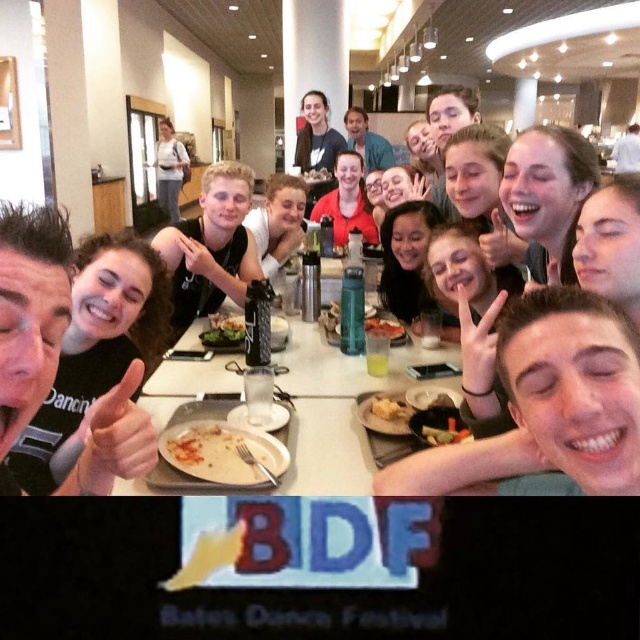
You are a photographer standing at the edge of the table in the dining area. You need to capture a photo of both the matte black shirt at upper center and the translucent plastic cup at center without moving the subjects. Can you position yourself in a way that both items are in your camera frame at the same time?

The distance between the matte black shirt at upper center and the translucent plastic cup at center is 3.65 meters. Since the photographer is at the edge of the table, they can likely position themselves to include both items in the frame as the distance is manageable for a wide enough angle lens or by adjusting their position to ensure both are visible.

You are a photographer taking a group photo of the light brown hair at center and the green leafy salad at center. To ensure both are in focus, you need to know their positions. Which object is positioned to the left?

The light brown hair at center is to the left of the green leafy salad at center, so the light brown hair at center is positioned to the left.